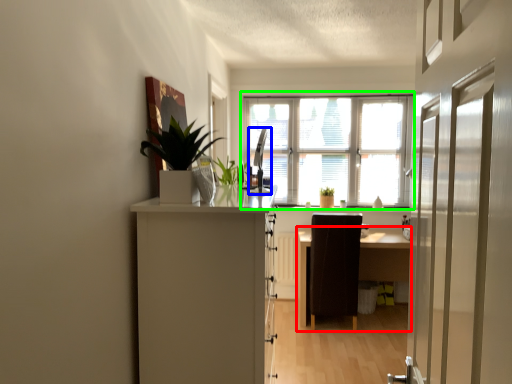
Question: Estimate the real-world distances between objects in this image. Which object is closer to table (highlighted by a red box), silver (highlighted by a blue box) or window (highlighted by a green box)?

Choices:
 (A) silver
 (B) window

Answer: (B)